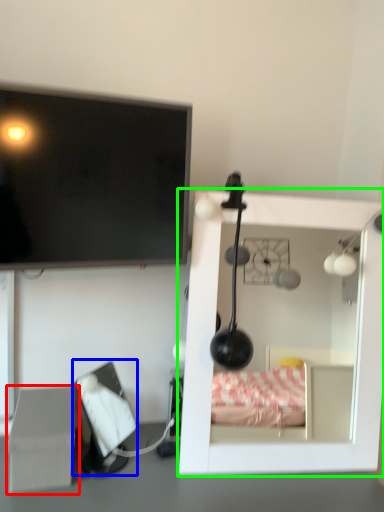
Question: Based on their relative distances, which object is farther from cardboard box (highlighted by a red box)? Choose from computer monitor (highlighted by a blue box) and furniture (highlighted by a green box).

Choices:
 (A) computer monitor
 (B) furniture

Answer: (B)